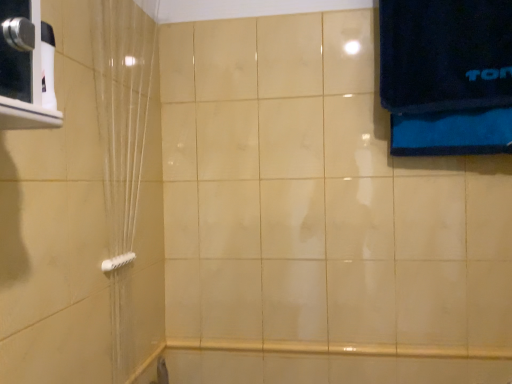
Question: Does white plastic towel bar at lower left appear on the right side of translucent plastic shower curtain at left?

Choices:
 (A) yes
 (B) no

Answer: (B)

Question: Is white plastic towel bar at lower left thinner than translucent plastic shower curtain at left?

Choices:
 (A) no
 (B) yes

Answer: (B)

Question: Considering the relative sizes of white plastic towel bar at lower left and translucent plastic shower curtain at left in the image provided, is white plastic towel bar at lower left smaller than translucent plastic shower curtain at left?

Choices:
 (A) no
 (B) yes

Answer: (B)

Question: Does white plastic towel bar at lower left have a larger size compared to translucent plastic shower curtain at left?

Choices:
 (A) yes
 (B) no

Answer: (B)

Question: Is white plastic towel bar at lower left placed right next to translucent plastic shower curtain at left?

Choices:
 (A) yes
 (B) no

Answer: (B)

Question: From a real-world perspective, does white plastic towel bar at lower left sit lower than translucent plastic shower curtain at left?

Choices:
 (A) no
 (B) yes

Answer: (B)

Question: Is translucent plastic shower curtain at left outside of white plastic towel bar at lower left?

Choices:
 (A) yes
 (B) no

Answer: (A)

Question: Is translucent plastic shower curtain at left positioned before white plastic towel bar at lower left?

Choices:
 (A) no
 (B) yes

Answer: (B)

Question: Is translucent plastic shower curtain at left to the left of white plastic towel bar at lower left from the viewer's perspective?

Choices:
 (A) yes
 (B) no

Answer: (B)

Question: Can you confirm if translucent plastic shower curtain at left is thinner than white plastic towel bar at lower left?

Choices:
 (A) no
 (B) yes

Answer: (A)

Question: Is translucent plastic shower curtain at left at the right side of white plastic towel bar at lower left?

Choices:
 (A) yes
 (B) no

Answer: (A)

Question: Is translucent plastic shower curtain at left turned away from white plastic towel bar at lower left?

Choices:
 (A) yes
 (B) no

Answer: (A)

Question: Which is correct: translucent plastic shower curtain at left is inside white plastic towel bar at lower left, or outside of it?

Choices:
 (A) outside
 (B) inside

Answer: (A)